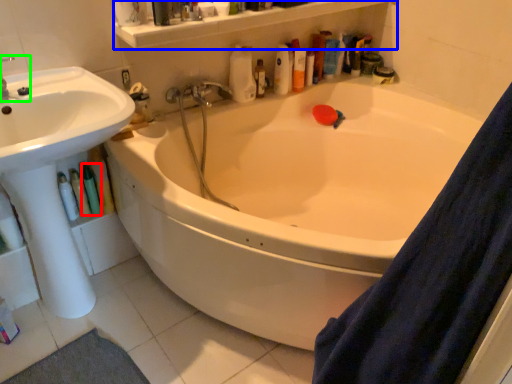
Question: Based on their relative distances, which object is nearer to toiletry (highlighted by a red box)? Choose from balustrade (highlighted by a blue box) and plumbing fixture (highlighted by a green box).

Choices:
 (A) balustrade
 (B) plumbing fixture

Answer: (B)